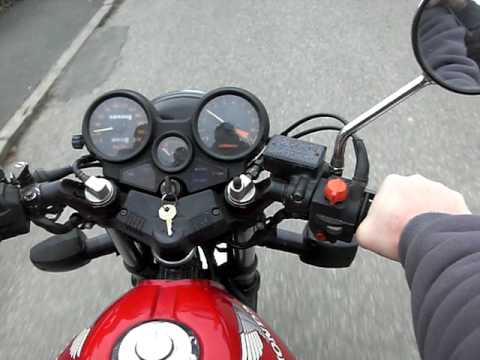
In order to click on keys in this screenshot , I will do `click(164, 216)`, `click(164, 187)`.